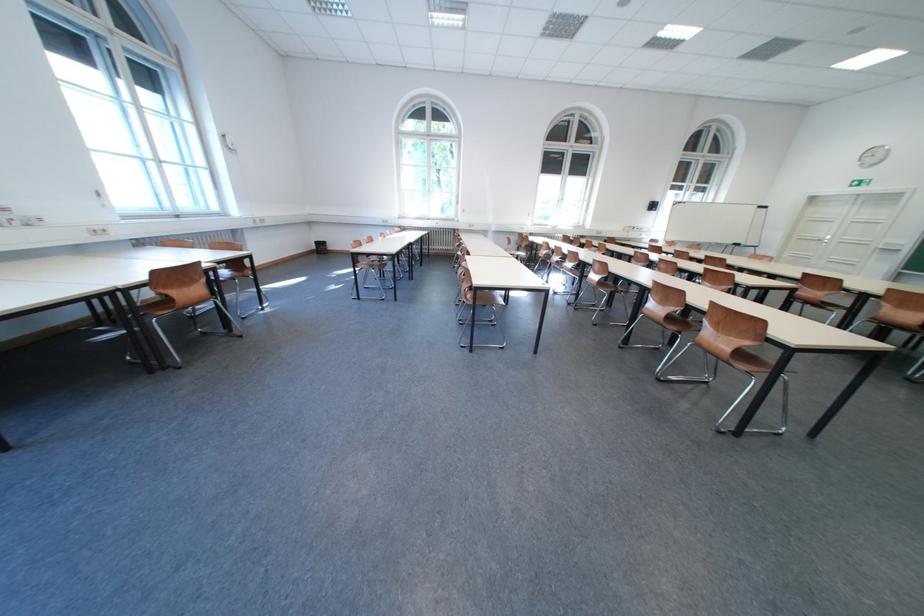
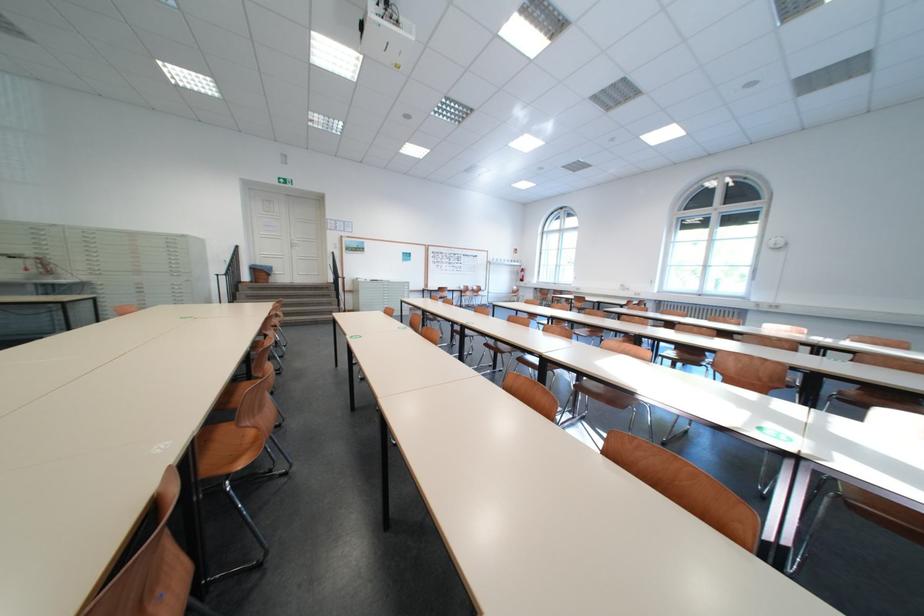
Question: I am providing you with two images of the same scene from different viewpoints. Which of the following objects are not visible in image2?

Choices:
 (A) grey drawer handle
 (B) brown chair sitting surface
 (C) clear soap dispenser
 (D) brown chair surface

Answer: (B)